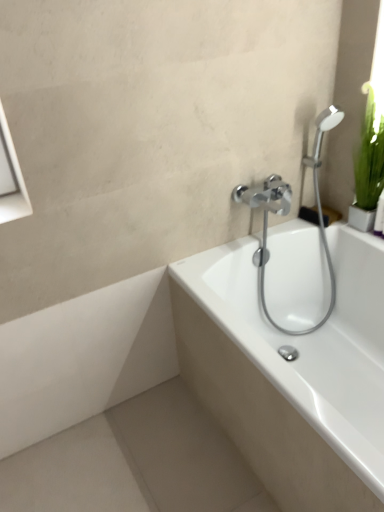
Question: Can you confirm if chrome metallic showerhead at upper right is bigger than white glossy bathtub at center?

Choices:
 (A) no
 (B) yes

Answer: (A)

Question: Can you confirm if chrome metallic showerhead at upper right is thinner than white glossy bathtub at center?

Choices:
 (A) yes
 (B) no

Answer: (A)

Question: From a real-world perspective, is chrome metallic showerhead at upper right located beneath white glossy bathtub at center?

Choices:
 (A) yes
 (B) no

Answer: (B)

Question: From the image's perspective, is chrome metallic showerhead at upper right located beneath white glossy bathtub at center?

Choices:
 (A) no
 (B) yes

Answer: (A)

Question: Can you confirm if chrome metallic showerhead at upper right is positioned to the right of white glossy bathtub at center?

Choices:
 (A) no
 (B) yes

Answer: (A)

Question: From the image's perspective, would you say chrome metallic showerhead at upper right is positioned over white glossy bathtub at center?

Choices:
 (A) yes
 (B) no

Answer: (A)

Question: Is white glossy bathtub at center taller than chrome metallic showerhead at upper right?

Choices:
 (A) yes
 (B) no

Answer: (B)

Question: From the image's perspective, does white glossy bathtub at center appear higher than chrome metallic showerhead at upper right?

Choices:
 (A) yes
 (B) no

Answer: (B)

Question: Does white glossy bathtub at center come in front of chrome metallic showerhead at upper right?

Choices:
 (A) yes
 (B) no

Answer: (A)

Question: Does white glossy bathtub at center come behind chrome metallic showerhead at upper right?

Choices:
 (A) yes
 (B) no

Answer: (B)

Question: Is white glossy bathtub at center wider than chrome metallic showerhead at upper right?

Choices:
 (A) yes
 (B) no

Answer: (A)

Question: Is white glossy bathtub at center oriented towards chrome metallic showerhead at upper right?

Choices:
 (A) no
 (B) yes

Answer: (A)

Question: In terms of width, does white glossy bathtub at center look wider or thinner when compared to chrome metallic showerhead at upper right?

Choices:
 (A) wide
 (B) thin

Answer: (A)